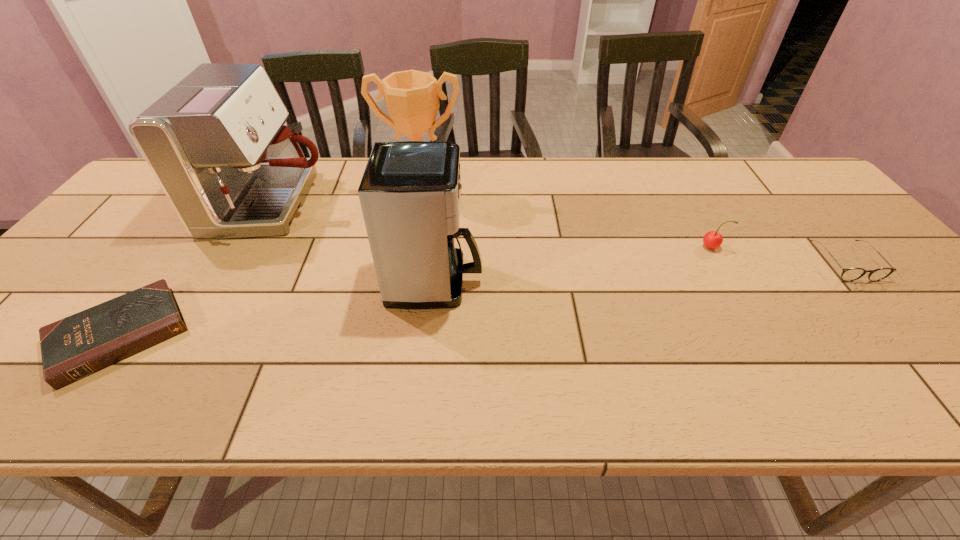
Locate an element on the screen. The width and height of the screenshot is (960, 540). vacant area that lies between the nearer coffee maker and the Bible is located at coordinates (277, 308).

Locate an element on the screen. This screenshot has height=540, width=960. unoccupied position between the fifth tallest object and the cherry is located at coordinates (778, 255).

This screenshot has width=960, height=540. What are the coordinates of `free spot between the cherry and the nearer coffee maker` in the screenshot? It's located at (573, 264).

Choose which object is the third nearest neighbor to the nearer coffee maker. Please provide its 2D coordinates. Your answer should be formatted as a tuple, i.e. [(x, y)], where the tuple contains the x and y coordinates of a point satisfying the conditions above.

[(72, 348)]

The image size is (960, 540). Identify the location of object that is the closest to the farther coffee maker. (412, 97).

This screenshot has width=960, height=540. I want to click on free space that satisfies the following two spatial constraints: 1. through the lenses of the fifth tallest object; 2. on the front panel of the nearer coffee maker, so click(x=860, y=281).

Find the location of a particular element. vacant space that satisfies the following two spatial constraints: 1. through the lenses of the second shortest object; 2. on the front panel of the nearer coffee maker is located at coordinates (860, 281).

Where is `vacant space that satisfies the following two spatial constraints: 1. through the lenses of the rightmost object; 2. on the front panel of the right coffee maker`? The width and height of the screenshot is (960, 540). vacant space that satisfies the following two spatial constraints: 1. through the lenses of the rightmost object; 2. on the front panel of the right coffee maker is located at coordinates (860, 281).